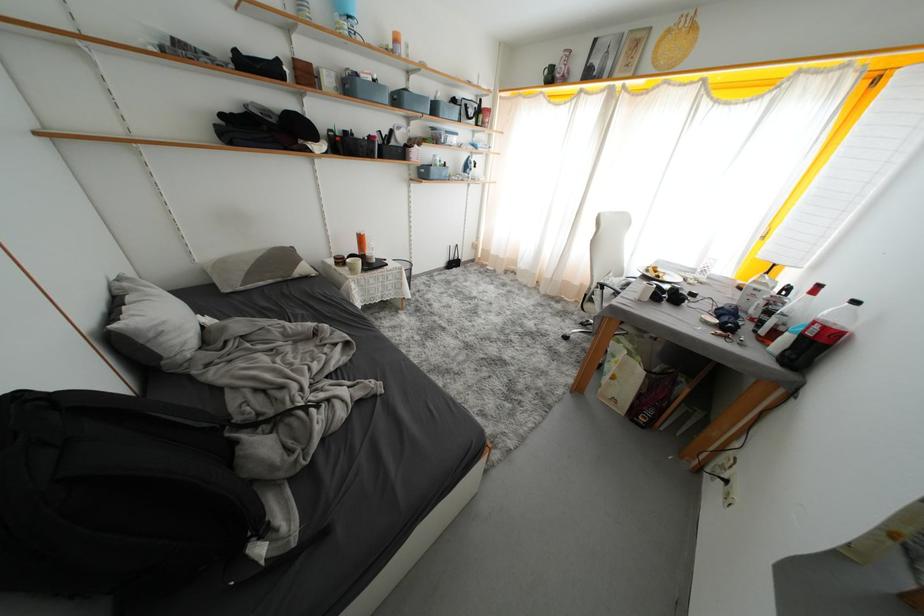
You are a GUI agent. You are given a task and a screenshot of the screen. Output one action in this format:
    pyautogui.click(x=<x>, y=<y>)
    Task: Click on the white mug
    The height and width of the screenshot is (616, 924).
    Given the screenshot: What is the action you would take?
    pyautogui.click(x=399, y=132)